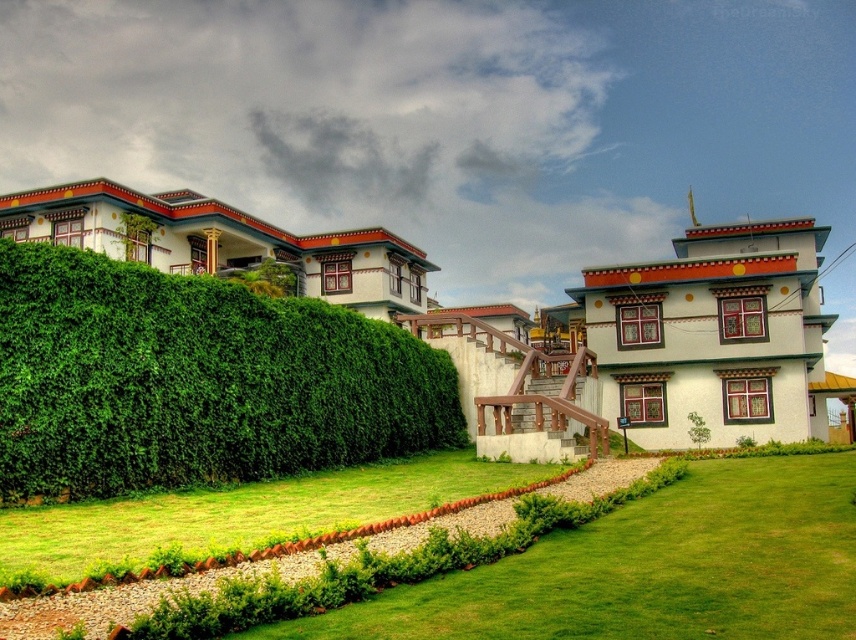
You are planning to install a new pathway between the green leafy hedge at left and the green grass at center. Based on their widths, which area would require a narrower pathway? Please explain your reasoning.

The green leafy hedge at left has a lesser width compared to the green grass at center. Therefore, the pathway near the green leafy hedge at left would need to be narrower to accommodate its smaller width.

You are standing at the center of the image. Which direction should you face to see the green leafy hedge at left?

The green leafy hedge at left is located at point (195, 380), so you should face towards the left side of the image to see it.